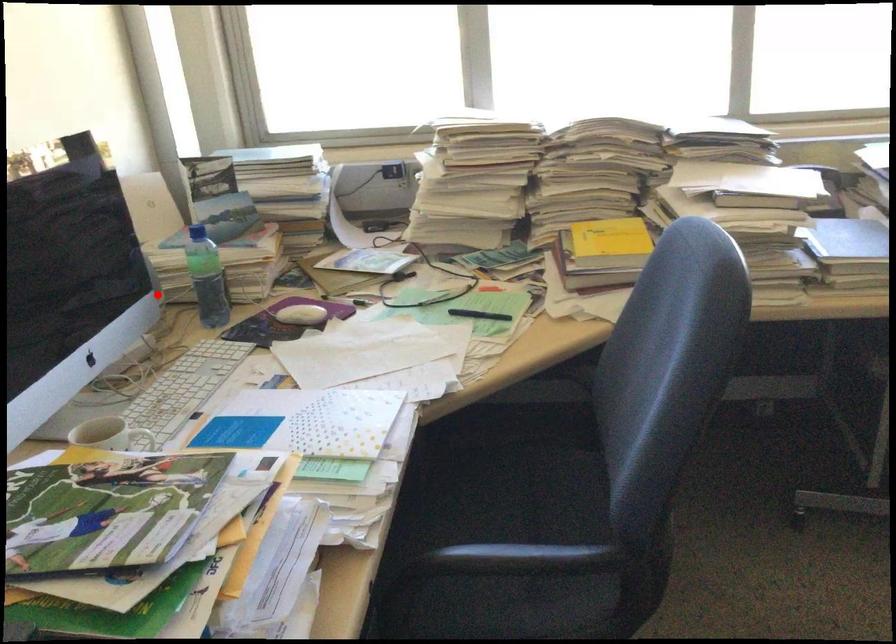
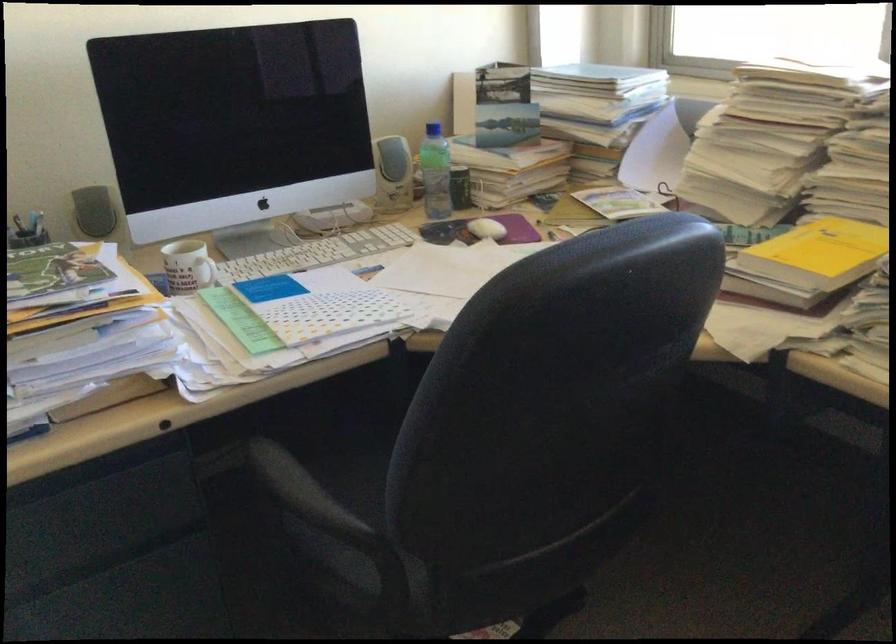
Question: I am providing you with two images of the same scene from different viewpoints. In image1, a red point is highlighted. Considering the same 3D point in image2, which of the following is correct?

Choices:
 (A) It is closer
 (B) It is farther

Answer: (B)